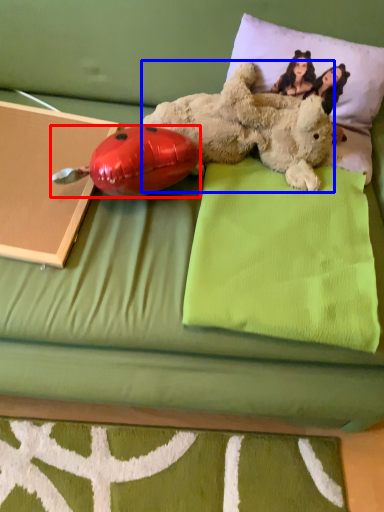
Question: Among these objects, which one is farthest to the camera, ladybug (highlighted by a red box) or teddy bear (highlighted by a blue box)?

Choices:
 (A) ladybug
 (B) teddy bear

Answer: (B)